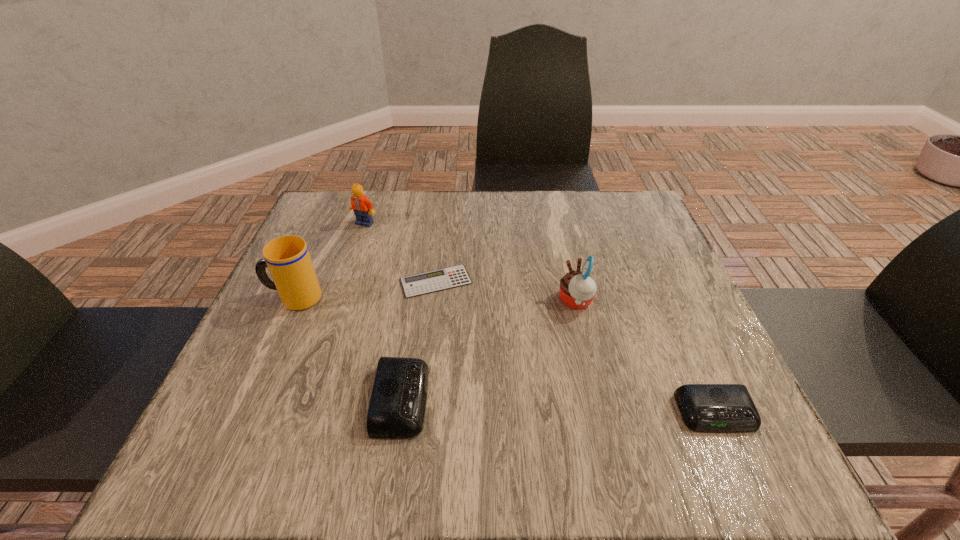
Identify the location of object that is positioned at the far left corner. (362, 207).

Where is `object that is at the near right corner`? object that is at the near right corner is located at coordinates (725, 408).

Locate an element on the screen. free region at the far edge of the desktop is located at coordinates (565, 191).

At what (x,y) coordinates should I click in order to perform the action: click on vacant space at the near edge of the desktop. Please return your answer as a coordinate pair (x, y). The image size is (960, 540). Looking at the image, I should click on (618, 416).

Where is `free region at the left edge of the desktop`? The width and height of the screenshot is (960, 540). free region at the left edge of the desktop is located at coordinates tap(279, 367).

In the image, there is a desktop. At what (x,y) coordinates should I click in order to perform the action: click on vacant space at the right edge. Please return your answer as a coordinate pair (x, y). Looking at the image, I should click on (656, 253).

Where is `vacant space at the far right corner of the desktop`? vacant space at the far right corner of the desktop is located at coordinates (607, 197).

Where is `free area in between the farthest object and the rightmost object`? Image resolution: width=960 pixels, height=540 pixels. free area in between the farthest object and the rightmost object is located at coordinates (540, 318).

Image resolution: width=960 pixels, height=540 pixels. In order to click on free space between the muffin and the taller alarm clock in this screenshot , I will do `click(489, 350)`.

This screenshot has width=960, height=540. In order to click on free space between the muffin and the right alarm clock in this screenshot , I will do `click(646, 357)`.